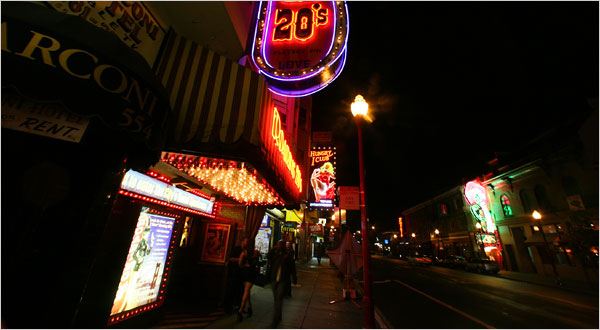
In order to click on lights around a poster in this screenshot , I will do `click(168, 256)`, `click(160, 210)`, `click(151, 307)`.